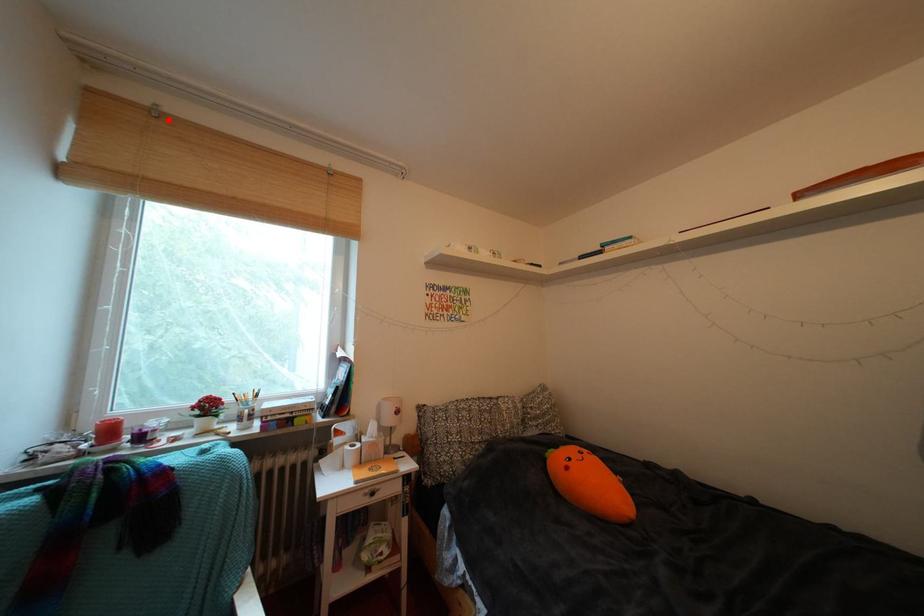
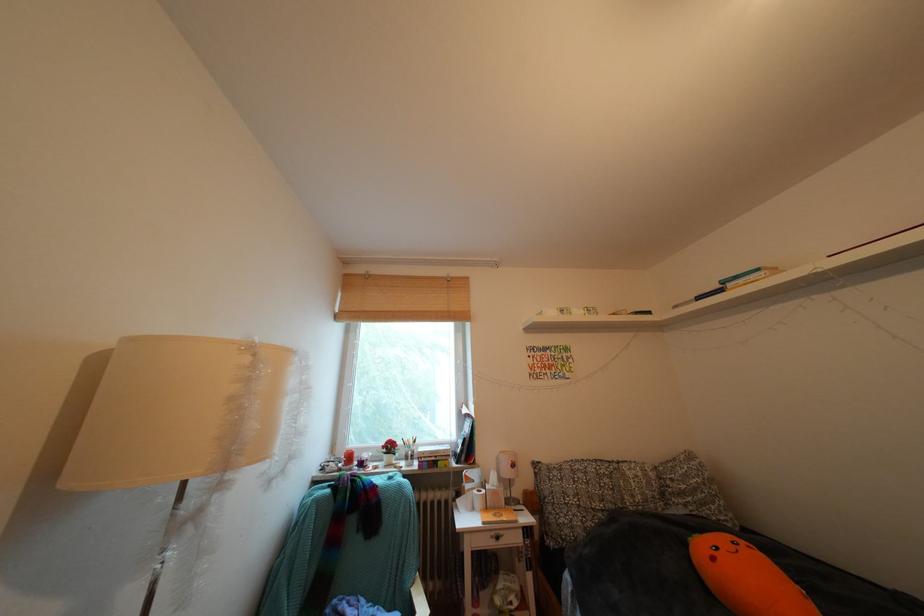
In the second image, find the point that corresponds to the highlighted location in the first image.

(379, 282)